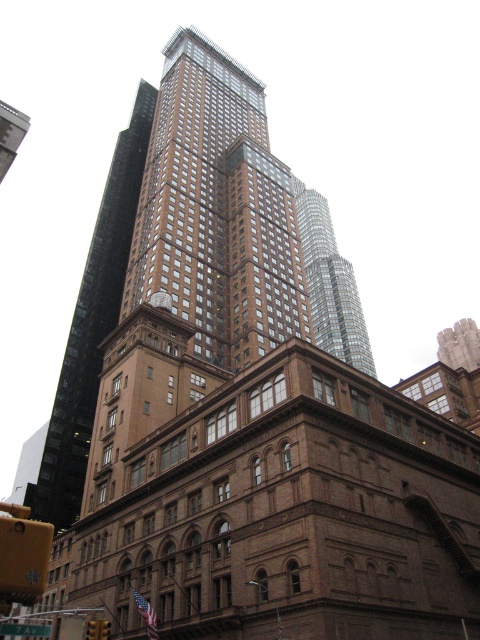
Find the location of a particular element. brown glassy building at center is located at coordinates (92, 326).

How far apart are brown glassy building at center and glassy reflective skyscraper at center?

They are 74.58 meters apart.

Between point (45, 518) and point (323, 200), which one is positioned behind?

Point (323, 200)

In order to click on brown glassy building at center in this screenshot , I will do `click(92, 326)`.